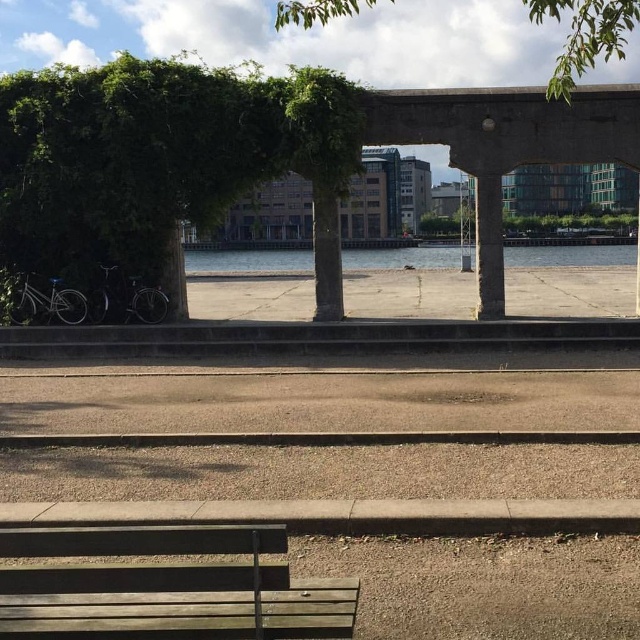
You are standing at the wooden bench at the bottom left corner of the riverside scene. You want to take a photo that includes both the green leafy tree at upper center and the clear water at center. Which object should appear closer to you in the photo?

The green leafy tree at upper center should appear closer to you in the photo because it is in front of the clear water at center according to the description.

You are standing at the wooden bench at the bottom left corner of the image. You see two points marked in the scene, point (328, 8) and point (609, 248). Which point is closer to you?

Point (328, 8) is closer to the camera than point (609, 248), so the point closer to you is point (328, 8).